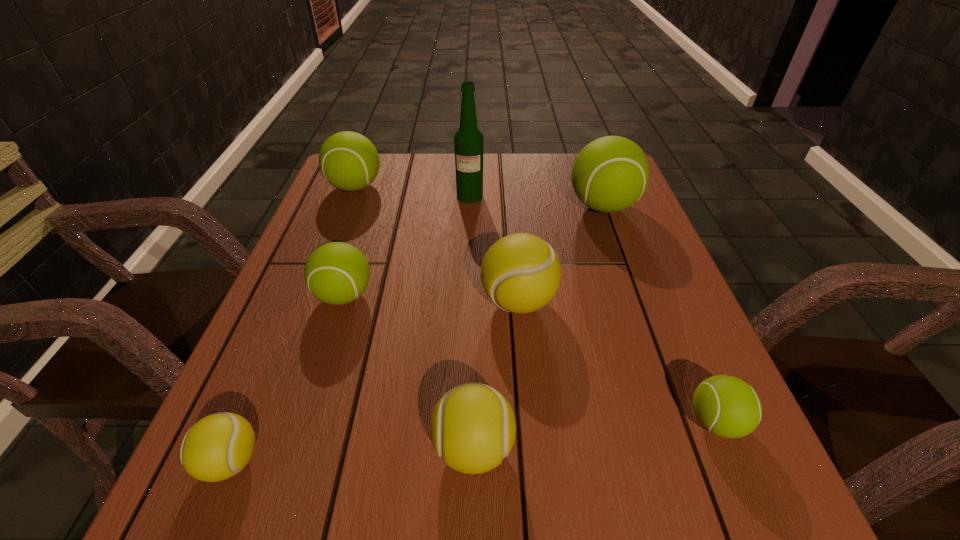
Image resolution: width=960 pixels, height=540 pixels. I want to click on green beer bottle, so click(468, 140).

Locate an element on the screen. The image size is (960, 540). beer bottle is located at coordinates (468, 140).

Identify the location of the biggest green tennis ball. This screenshot has height=540, width=960. (610, 174).

You are a GUI agent. You are given a task and a screenshot of the screen. Output one action in this format:
    pyautogui.click(x=<x>, y=<y>)
    Task: Click on the seventh shortest object
    The height and width of the screenshot is (540, 960).
    Given the screenshot: What is the action you would take?
    pyautogui.click(x=610, y=174)

Where is `the biggest yellow tennis ball`? The height and width of the screenshot is (540, 960). the biggest yellow tennis ball is located at coordinates (521, 273).

The image size is (960, 540). I want to click on the second biggest green tennis ball, so click(x=349, y=161).

Identify the location of the third farthest green tennis ball. (336, 273).

Find the location of a particular element. The image size is (960, 540). the second smallest yellow tennis ball is located at coordinates 473,428.

You are a GUI agent. You are given a task and a screenshot of the screen. Output one action in this format:
    pyautogui.click(x=<x>, y=<y>)
    Task: Click on the nearest green tennis ball
    Image resolution: width=960 pixels, height=540 pixels.
    Given the screenshot: What is the action you would take?
    pyautogui.click(x=727, y=406)

Locate an element on the screen. Image resolution: width=960 pixels, height=540 pixels. the smallest yellow tennis ball is located at coordinates (217, 447).